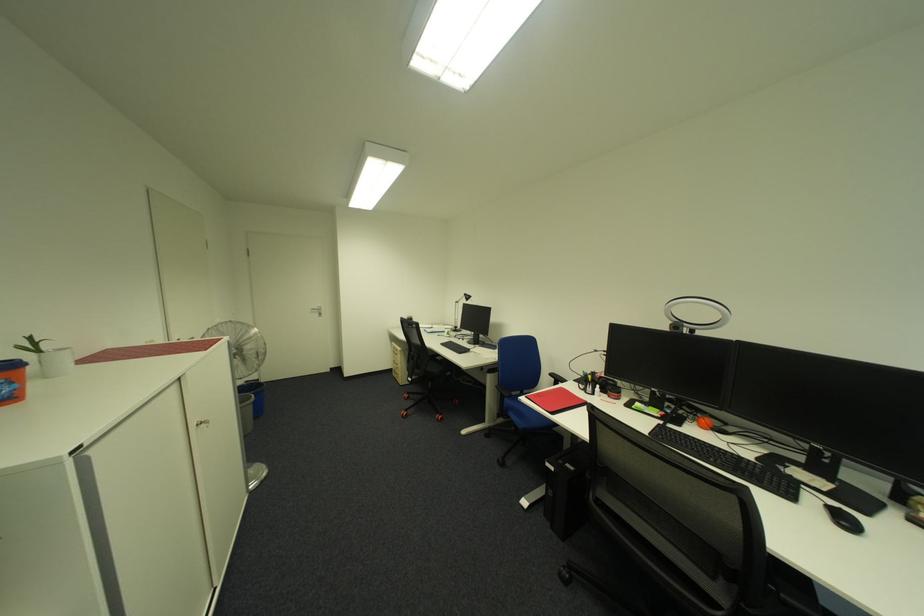
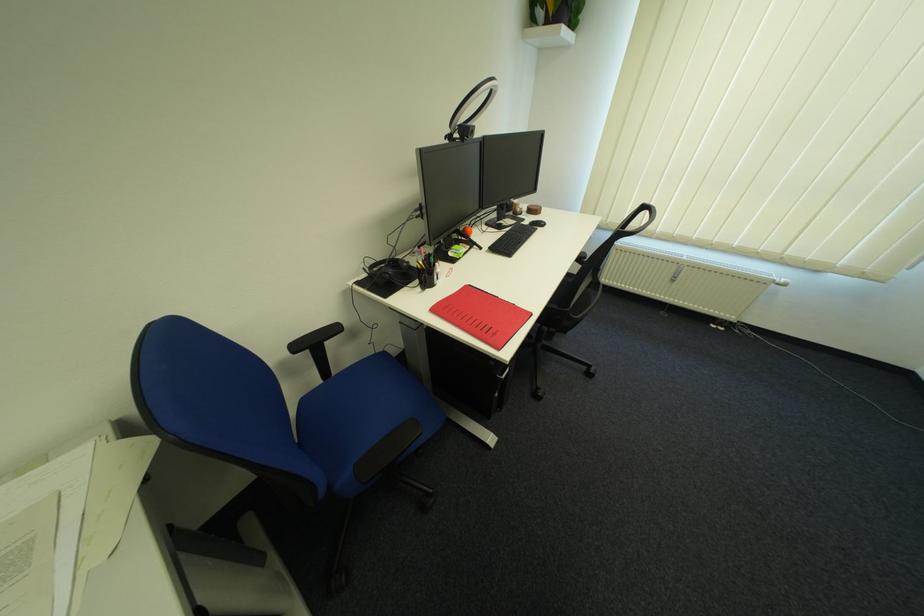
Find the pixel in the second image that matches point 669,416 in the first image.

(479, 248)